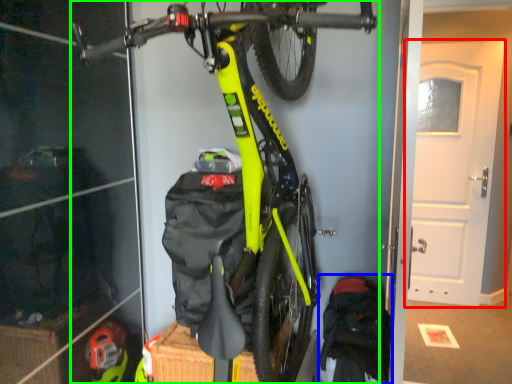
Question: Which object is the farthest from door (highlighted by a red box)? Choose among these: backpack (highlighted by a blue box) or bicycle (highlighted by a green box).

Choices:
 (A) backpack
 (B) bicycle

Answer: (B)